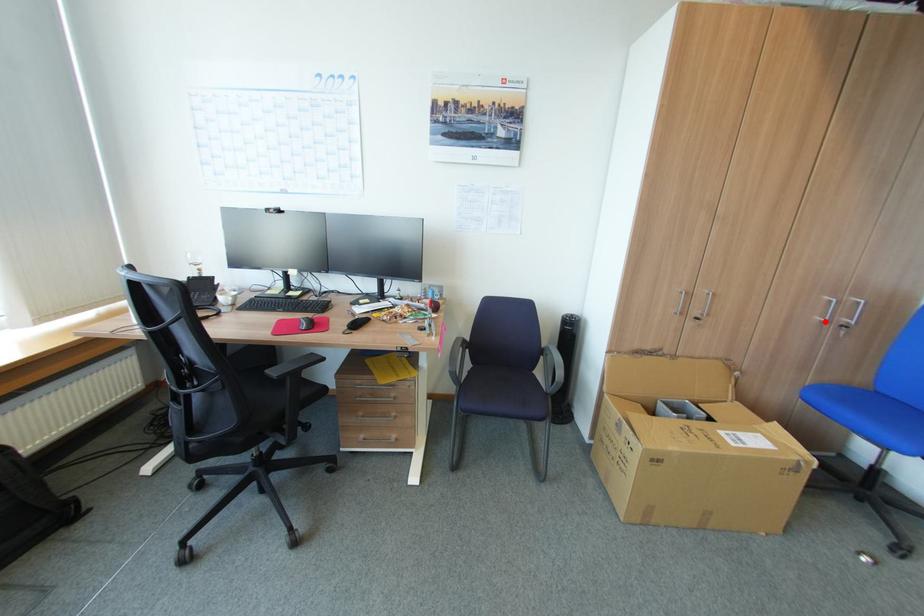
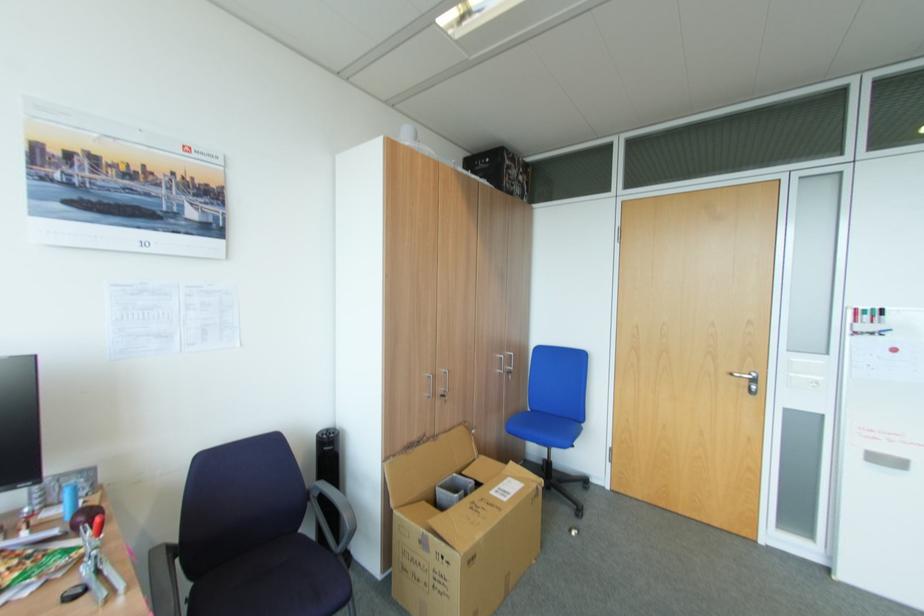
The point at the highlighted location is marked in the first image. Where is the corresponding point in the second image?

(505, 371)